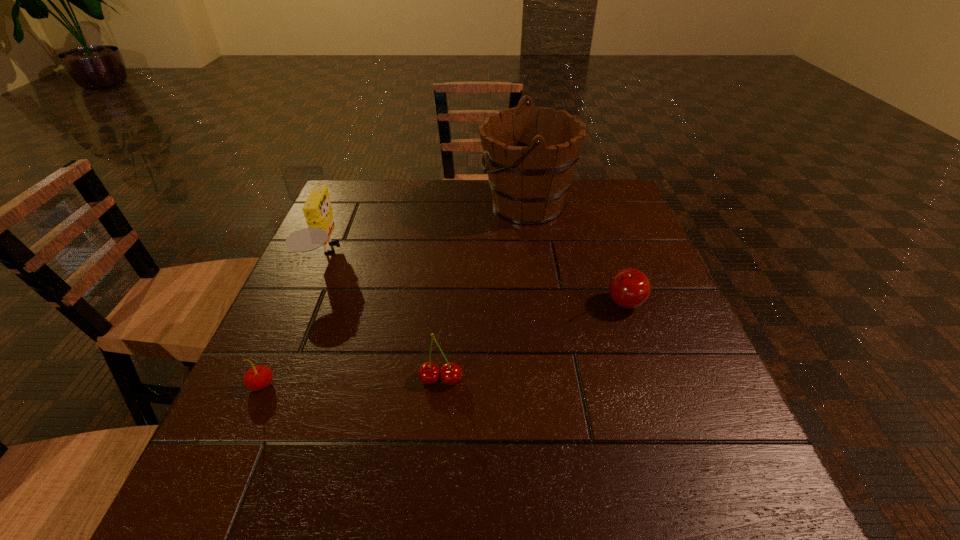
At what (x,y) coordinates should I click in order to perform the action: click on wine bucket. Please return your answer as a coordinate pair (x, y). Looking at the image, I should click on (530, 156).

Identify the location of the second tallest object. This screenshot has width=960, height=540. (317, 210).

Where is `the second cherry from right to left`? The image size is (960, 540). the second cherry from right to left is located at coordinates (429, 373).

You are a GUI agent. You are given a task and a screenshot of the screen. Output one action in this format:
    pyautogui.click(x=<x>, y=<y>)
    Task: Click on the farthest cherry
    This screenshot has width=960, height=540.
    Given the screenshot: What is the action you would take?
    pyautogui.click(x=629, y=288)

The height and width of the screenshot is (540, 960). What are the coordinates of `the third farthest object` in the screenshot? It's located at (629, 288).

You are a GUI agent. You are given a task and a screenshot of the screen. Output one action in this format:
    pyautogui.click(x=<x>, y=<y>)
    Task: Click on the shortest object
    This screenshot has height=540, width=960.
    Given the screenshot: What is the action you would take?
    pyautogui.click(x=257, y=378)

You are a GUI agent. You are given a task and a screenshot of the screen. Output one action in this format:
    pyautogui.click(x=<x>, y=<y>)
    Task: Click on the shortest cherry
    Image resolution: width=960 pixels, height=540 pixels.
    Given the screenshot: What is the action you would take?
    pyautogui.click(x=257, y=378)

This screenshot has height=540, width=960. In order to click on free space located 0.360m with the handle on the wine bucket in this screenshot , I will do `click(351, 205)`.

The height and width of the screenshot is (540, 960). Identify the location of free spot located 0.270m with the handle on the wine bucket. (383, 205).

Locate an element on the screen. The image size is (960, 540). vacant space located with the handle on the wine bucket is located at coordinates (348, 205).